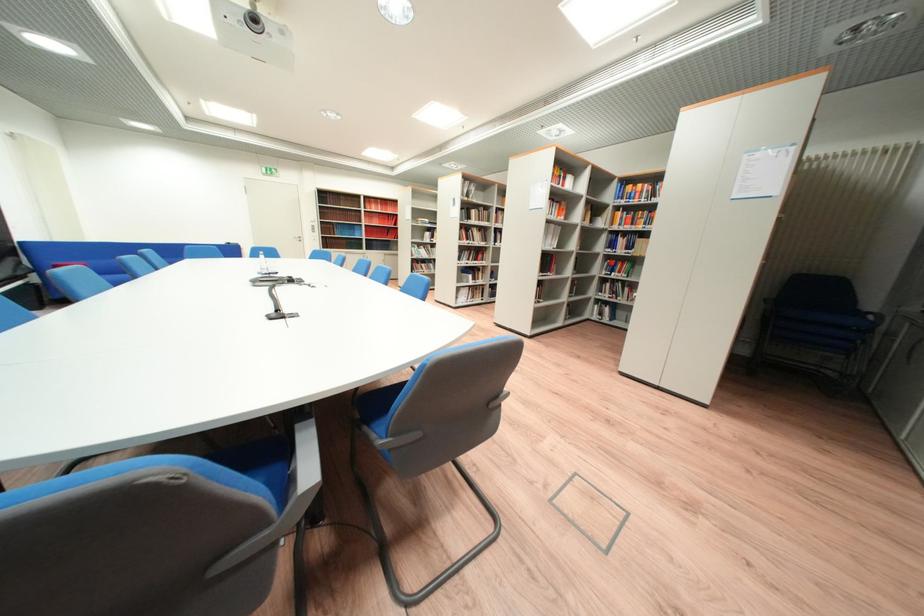
Where is `blue book`? blue book is located at coordinates (618, 191).